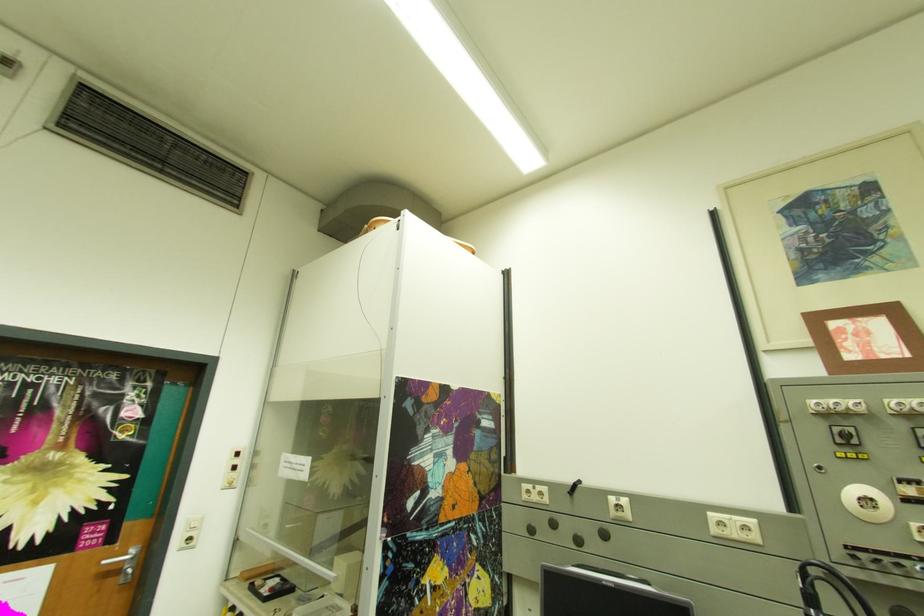
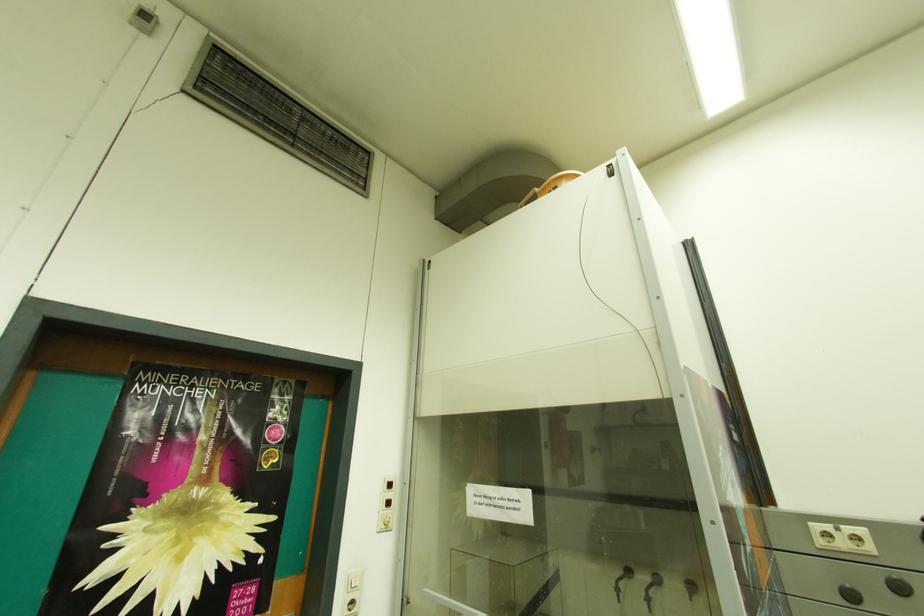
Locate, in the second image, the point that corresponds to the point at 131,434 in the first image.

(275, 460)